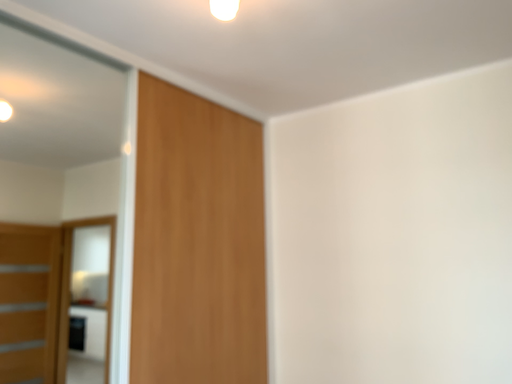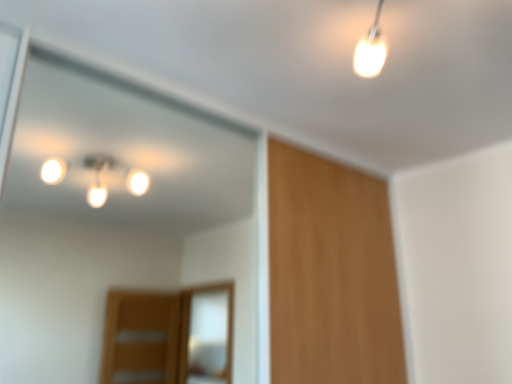
Question: Which way did the camera rotate in the video?

Choices:
 (A) rotated left
 (B) rotated right

Answer: (A)